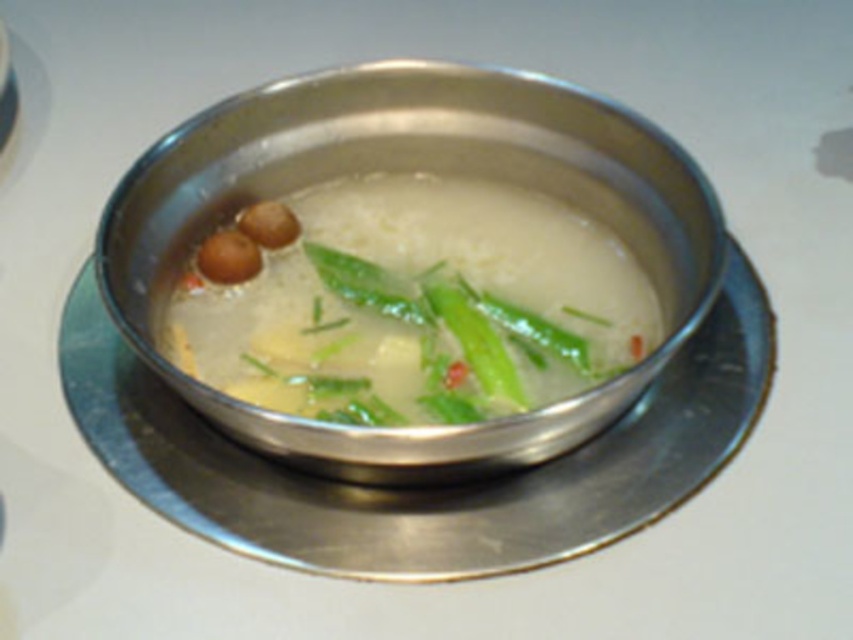
Question: Does satin silver bowl at center lie in front of green leafy vegetable at center?

Choices:
 (A) yes
 (B) no

Answer: (A)

Question: Which of the following is the closest to the observer?

Choices:
 (A) (434, 385)
 (B) (181, 131)

Answer: (A)

Question: Is satin silver bowl at center closer to the viewer compared to green leafy vegetable at center?

Choices:
 (A) yes
 (B) no

Answer: (A)

Question: Can you confirm if satin silver bowl at center is positioned to the left of green leafy vegetable at center?

Choices:
 (A) no
 (B) yes

Answer: (B)

Question: Which of the following is the farthest from the observer?

Choices:
 (A) (219, 417)
 (B) (299, 307)

Answer: (B)